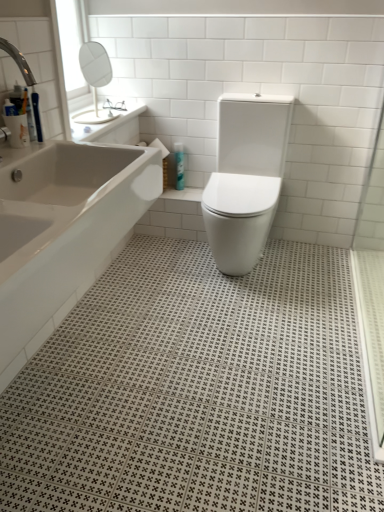
Question: Based on their sizes in the image, would you say blue glossy bottle at center is bigger or smaller than white glossy toilet at center?

Choices:
 (A) big
 (B) small

Answer: (B)

Question: From the image's perspective, is blue glossy bottle at center positioned above or below white glossy toilet at center?

Choices:
 (A) below
 (B) above

Answer: (B)

Question: Based on their relative distances, which object is nearer to the white glossy bathtub at left?

Choices:
 (A) blue glossy bottle at center
 (B) white glossy toilet at center

Answer: (B)

Question: Which is nearer to the white glossy bathtub at left?

Choices:
 (A) white glossy toilet at center
 (B) blue glossy bottle at center

Answer: (A)